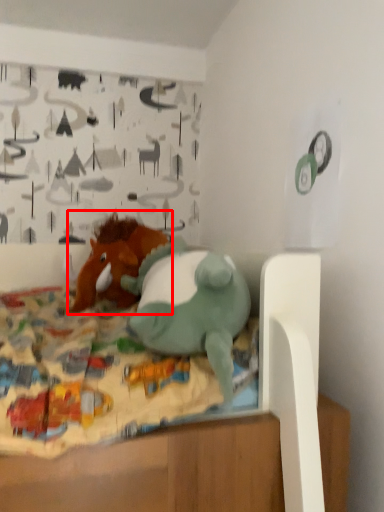
Question: From the image's perspective, considering the relative positions of toy (annotated by the red box) and toy in the image provided, where is toy (annotated by the red box) located with respect to the staircase?

Choices:
 (A) above
 (B) below

Answer: (A)